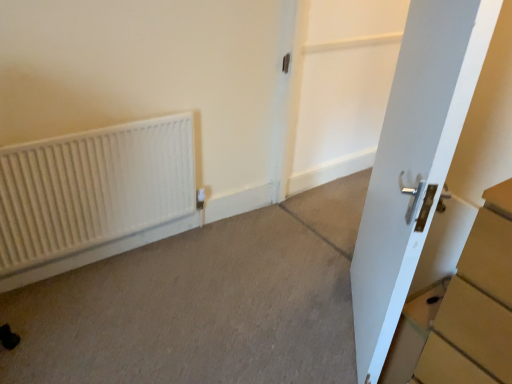
Question: Does gray carpet at lower left come behind white matte radiator at left?

Choices:
 (A) no
 (B) yes

Answer: (A)

Question: Is gray carpet at lower left beside white matte radiator at left?

Choices:
 (A) no
 (B) yes

Answer: (A)

Question: Does gray carpet at lower left have a greater height compared to white matte radiator at left?

Choices:
 (A) yes
 (B) no

Answer: (B)

Question: Can you confirm if gray carpet at lower left is bigger than white matte radiator at left?

Choices:
 (A) no
 (B) yes

Answer: (A)

Question: Is gray carpet at lower left thinner than white matte radiator at left?

Choices:
 (A) no
 (B) yes

Answer: (A)

Question: From a real-world perspective, relative to white matte radiator at left, is white glossy door at right vertically above or below?

Choices:
 (A) above
 (B) below

Answer: (A)

Question: Looking at the image, does white glossy door at right seem bigger or smaller compared to white matte radiator at left?

Choices:
 (A) big
 (B) small

Answer: (A)

Question: Which is correct: white glossy door at right is inside white matte radiator at left, or outside of it?

Choices:
 (A) outside
 (B) inside

Answer: (A)

Question: Is white glossy door at right to the left or to the right of white matte radiator at left in the image?

Choices:
 (A) right
 (B) left

Answer: (A)

Question: Considering the positions of point click(x=168, y=292) and point click(x=11, y=249), is point click(x=168, y=292) closer or farther from the camera than point click(x=11, y=249)?

Choices:
 (A) closer
 (B) farther

Answer: (B)

Question: Is gray carpet at lower left in front of or behind white matte radiator at left in the image?

Choices:
 (A) behind
 (B) front

Answer: (B)

Question: Considering the positions of gray carpet at lower left and white matte radiator at left in the image, is gray carpet at lower left taller or shorter than white matte radiator at left?

Choices:
 (A) tall
 (B) short

Answer: (B)

Question: Looking at their shapes, would you say gray carpet at lower left is wider or thinner than white matte radiator at left?

Choices:
 (A) wide
 (B) thin

Answer: (A)

Question: In the image, is white glossy door at center positioned in front of or behind white matte radiator at left?

Choices:
 (A) front
 (B) behind

Answer: (B)

Question: Is point (347, 89) closer or farther from the camera than point (20, 160)?

Choices:
 (A) closer
 (B) farther

Answer: (B)